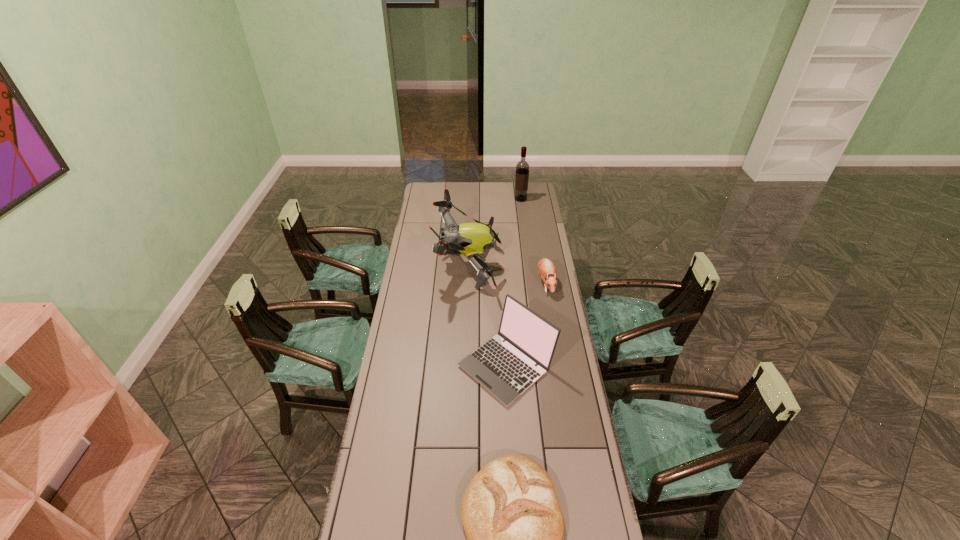
Locate an element on the screen. The width and height of the screenshot is (960, 540). vacant space positioned at the face of the second shortest object is located at coordinates (560, 364).

Identify the location of object that is at the far edge. The height and width of the screenshot is (540, 960). (522, 168).

This screenshot has height=540, width=960. Identify the location of object that is at the left edge. (470, 239).

The width and height of the screenshot is (960, 540). Identify the location of wine bottle that is at the right edge. (522, 168).

Where is `laptop_computer that is at the right edge`? laptop_computer that is at the right edge is located at coordinates (506, 369).

This screenshot has width=960, height=540. I want to click on hamster positioned at the right edge, so click(546, 269).

This screenshot has height=540, width=960. Identify the location of object present at the far right corner. (522, 168).

Image resolution: width=960 pixels, height=540 pixels. Identify the location of free space at the far edge of the desktop. (505, 185).

Locate an element on the screen. blank space at the left edge of the desktop is located at coordinates pos(407,432).

You are a GUI agent. You are given a task and a screenshot of the screen. Output one action in this format:
    pyautogui.click(x=<x>, y=<y>)
    Task: Click on the free space at the right edge of the desktop
    The height and width of the screenshot is (540, 960).
    Given the screenshot: What is the action you would take?
    pyautogui.click(x=556, y=441)